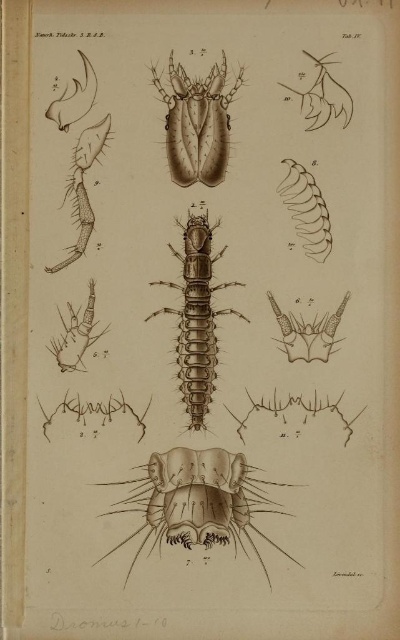
Question: Can you confirm if brown textured centipede at center is thinner than brown textured insect at center?

Choices:
 (A) no
 (B) yes

Answer: (A)

Question: Which of the following is the farthest from the observer?

Choices:
 (A) brown textured centipede at center
 (B) brown textured insect at center

Answer: (A)

Question: Which point appears farthest from the camera in this image?

Choices:
 (A) (204, 368)
 (B) (180, 88)

Answer: (A)

Question: Can you confirm if brown textured centipede at center is wider than brown textured insect at center?

Choices:
 (A) no
 (B) yes

Answer: (B)

Question: Observing the image, what is the correct spatial positioning of brown textured centipede at center in reference to brown textured insect at center?

Choices:
 (A) left
 (B) right

Answer: (B)

Question: Which point is farther from the camera taking this photo?

Choices:
 (A) (156, 88)
 (B) (220, 284)

Answer: (B)